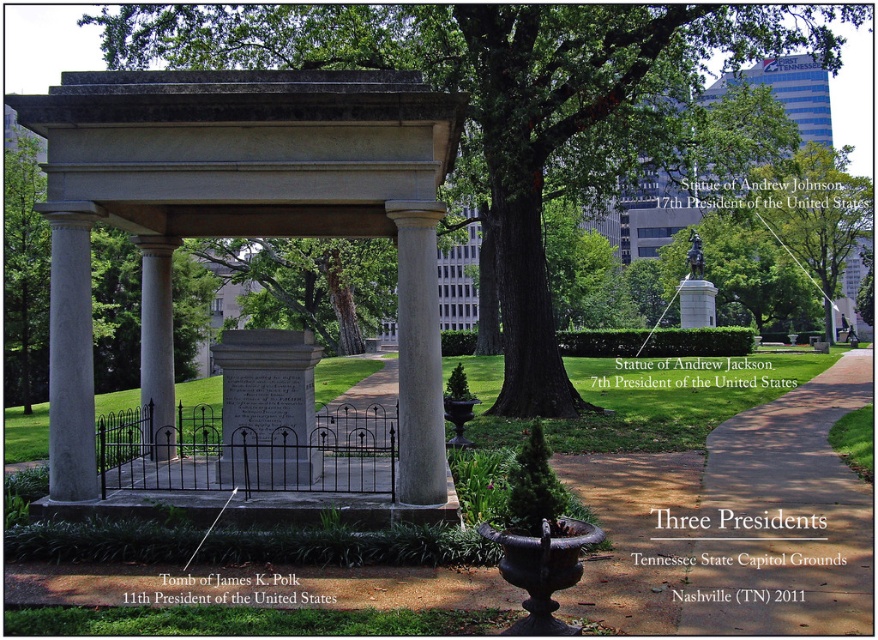
Question: Can you confirm if white marble column at left is wider than gray stone column at center?

Choices:
 (A) no
 (B) yes

Answer: (A)

Question: In this image, where is gray stone gazebo at center located relative to white marble column at center?

Choices:
 (A) left
 (B) right

Answer: (A)

Question: Which object is farther from the camera taking this photo?

Choices:
 (A) green leafy tree at center
 (B) brown paved path at center-right
 (C) green leafy tree at upper center

Answer: (C)

Question: Which of the following is the closest to the observer?

Choices:
 (A) brown paved path at center-right
 (B) green leafy tree at center
 (C) white marble column at left
 (D) gray stone gazebo at center

Answer: (A)

Question: Can you confirm if gray stone gazebo at center is positioned above white marble column at left?

Choices:
 (A) no
 (B) yes

Answer: (A)

Question: Estimate the real-world distances between objects in this image. Which object is closer to the brown paved path at center-right?

Choices:
 (A) green leafy tree at center
 (B) white marble column at left
 (C) gray stone gazebo at center

Answer: (C)